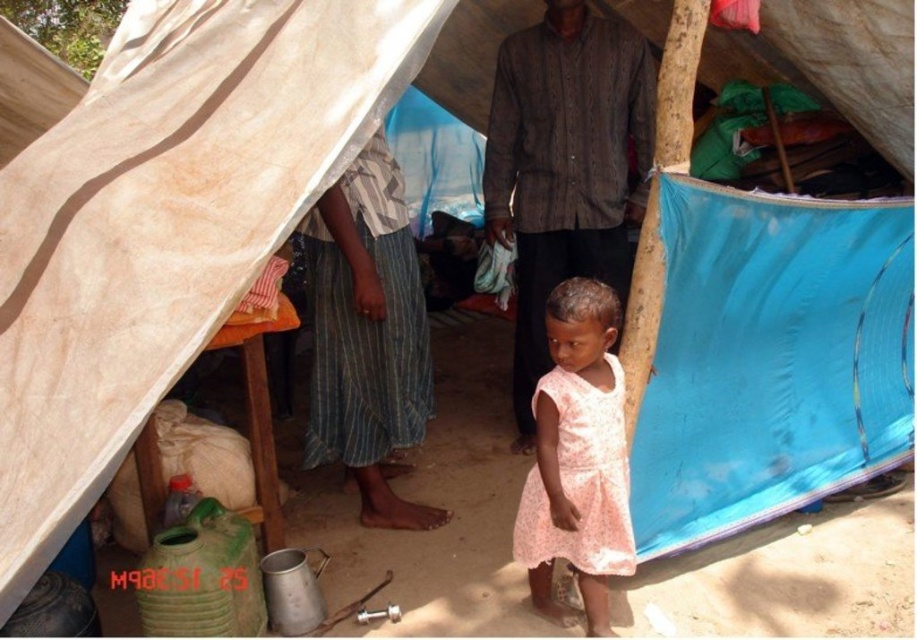
Looking at this image, you are organizing a clothing donation drive and need to determine if a storage box that can hold items up to 1 meter in width can accommodate both the textured brown shirt at center and the pink floral fabric dress at center. Can both items fit side by side in the box?

The textured brown shirt at center is wider than the pink floral fabric dress at center. Since the storage box can hold items up to 1 meter in width, both items can fit side by side as long as their combined widths do not exceed 1 meter. However, without knowing the exact width of each item, it is impossible to confirm definitively.

You are a photographer standing outside the shelter and want to capture both the textured brown shirt at center and the pink floral fabric dress at center in your photo. Which of these two items will appear closer to the camera in the final image?

The textured brown shirt at center will appear closer to the camera because it is positioned further to the viewer than the pink floral fabric dress at center.

You are standing outside the shelter and looking towards the entrance. There are two points marked in the image, point (527,442) and point (620,460). Which point is closer to you?

Point (527,442) is further to the camera than point (620,460), so the point closer to you is point (620,460).